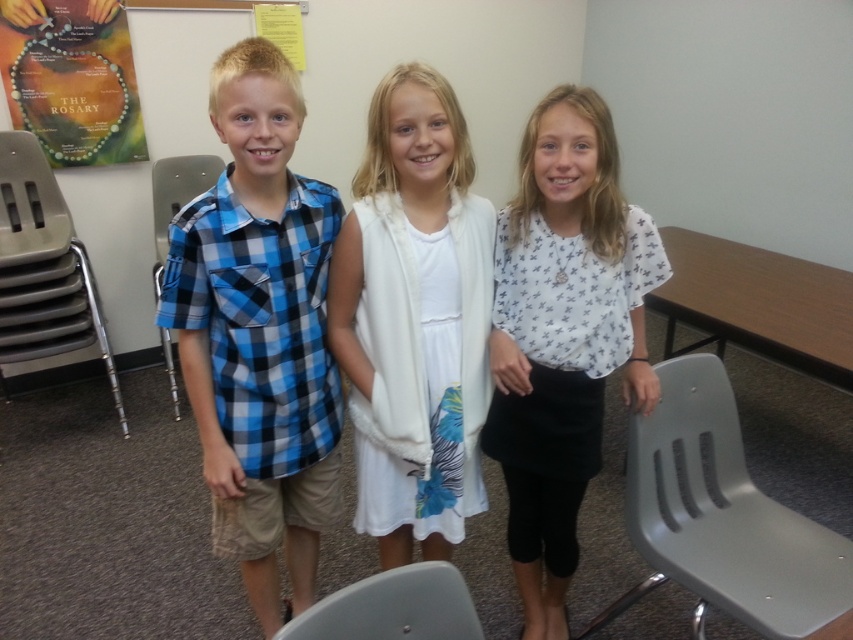
Image resolution: width=853 pixels, height=640 pixels. Describe the element at coordinates (721, 516) in the screenshot. I see `gray plastic chair at lower right` at that location.

Is point (654, 540) more distant than point (816, 282)?

No, (654, 540) is closer to viewer.

Does point (709, 419) lie in front of point (724, 275)?

Yes, it is in front of point (724, 275).

This screenshot has width=853, height=640. What are the coordinates of `gray plastic chair at lower right` in the screenshot? It's located at (721, 516).

Who is higher up, matte paper poster at upper left or blue plaid shirt at left?

matte paper poster at upper left is higher up.

Does matte paper poster at upper left have a greater width compared to blue plaid shirt at left?

Indeed, matte paper poster at upper left has a greater width compared to blue plaid shirt at left.

The image size is (853, 640). What do you see at coordinates (73, 80) in the screenshot?
I see `matte paper poster at upper left` at bounding box center [73, 80].

Where is `matte paper poster at upper left`? This screenshot has height=640, width=853. matte paper poster at upper left is located at coordinates (73, 80).

Does white fur vest at center have a lesser height compared to gray plastic chair at lower right?

Incorrect, white fur vest at center's height does not fall short of gray plastic chair at lower right's.

Does white fur vest at center appear under gray plastic chair at lower right?

No, white fur vest at center is not below gray plastic chair at lower right.

This screenshot has height=640, width=853. In order to click on white fur vest at center in this screenshot , I will do `click(415, 317)`.

This screenshot has width=853, height=640. In order to click on white fur vest at center in this screenshot , I will do `click(415, 317)`.